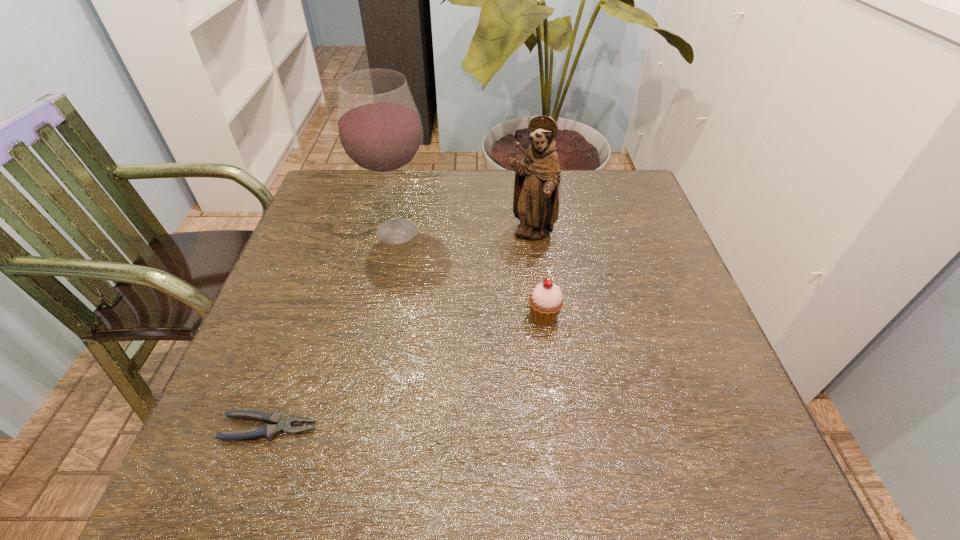
Locate an element on the screen. empty space between the alcohol and the third farthest object is located at coordinates (470, 274).

Locate an element on the screen. free space between the alcohol and the figurine is located at coordinates (464, 233).

Where is `object that is the closest to the figurine`? object that is the closest to the figurine is located at coordinates (546, 300).

Identify which object is the third closest to the nearest object. Please provide its 2D coordinates. Your answer should be formatted as a tuple, i.e. [(x, y)], where the tuple contains the x and y coordinates of a point satisfying the conditions above.

[(537, 177)]

You are a GUI agent. You are given a task and a screenshot of the screen. Output one action in this format:
    pyautogui.click(x=<x>, y=<y>)
    Task: Click on the vacant space that satisfies the following two spatial constraints: 1. on the front side of the alcohol; 2. on the right side of the second nearest object
    Image resolution: width=960 pixels, height=540 pixels.
    Given the screenshot: What is the action you would take?
    tap(379, 316)